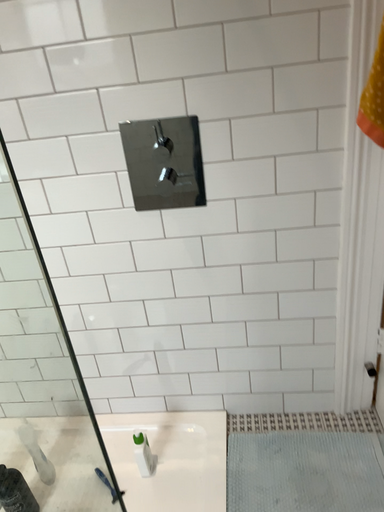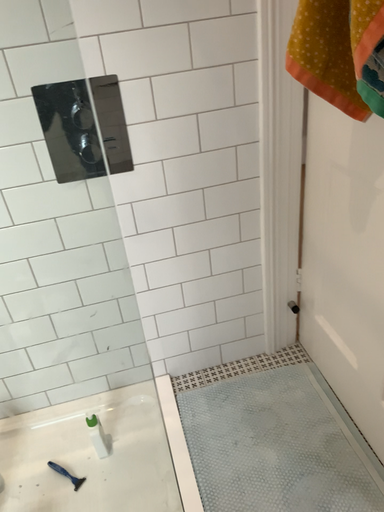
Question: Which way did the camera rotate in the video?

Choices:
 (A) rotated left
 (B) rotated right

Answer: (B)